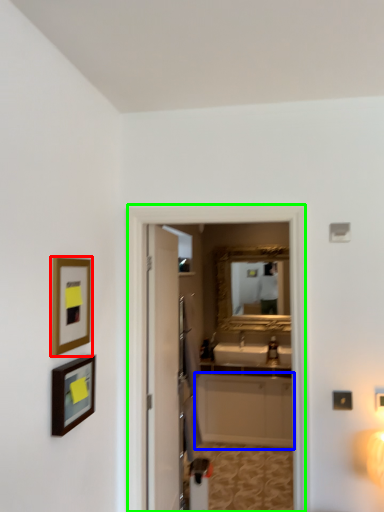
Question: Based on their relative distances, which object is farther from picture frame (highlighted by a red box)? Choose from cabinetry (highlighted by a blue box) and screen door (highlighted by a green box).

Choices:
 (A) cabinetry
 (B) screen door

Answer: (A)